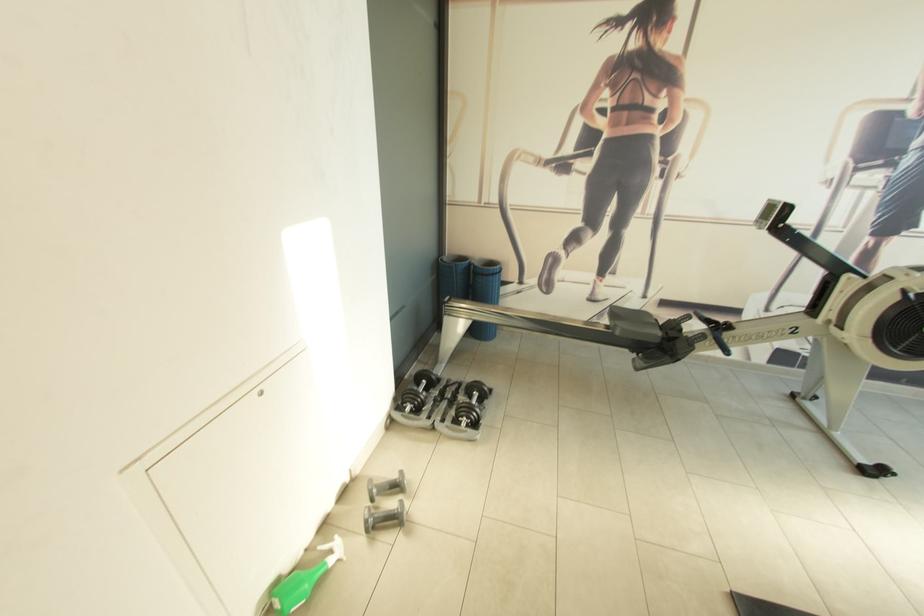
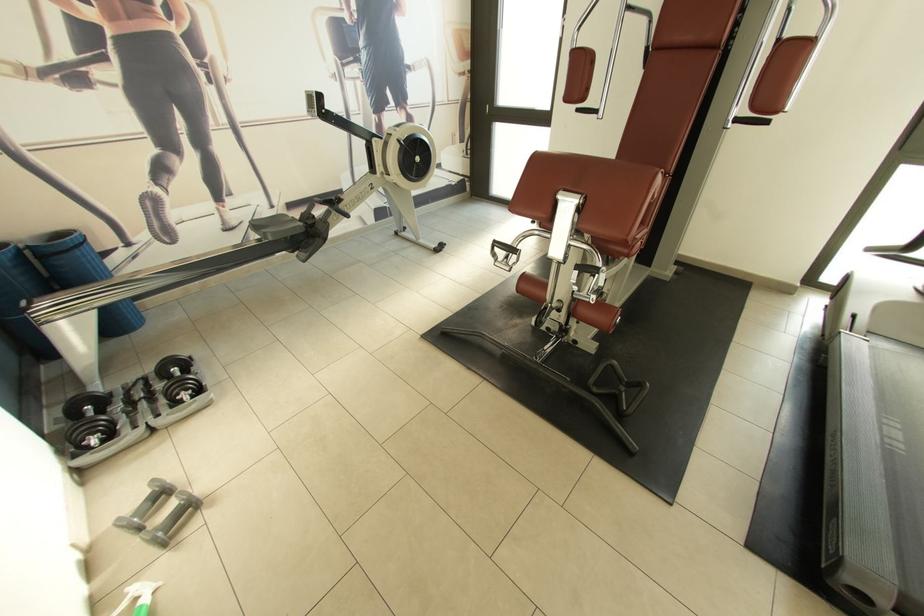
The point at (621, 314) is marked in the first image. Where is the corresponding point in the second image?

(262, 227)